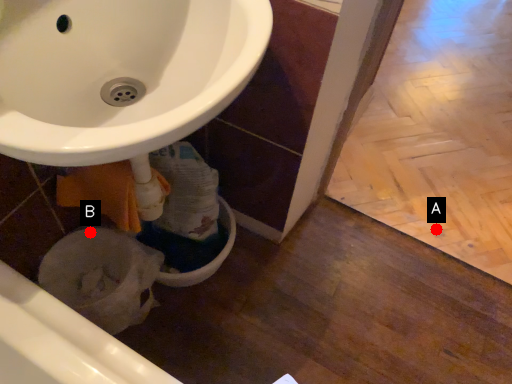
Question: Two points are circled on the image, labeled by A and B beside each circle. Which point appears farthest from the camera in this image?

Choices:
 (A) A is further
 (B) B is further

Answer: (A)